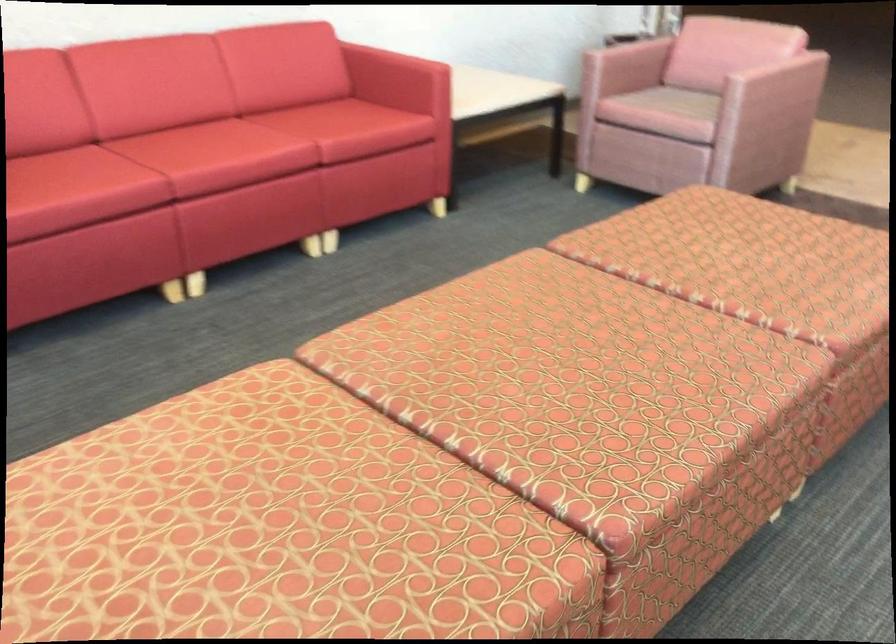
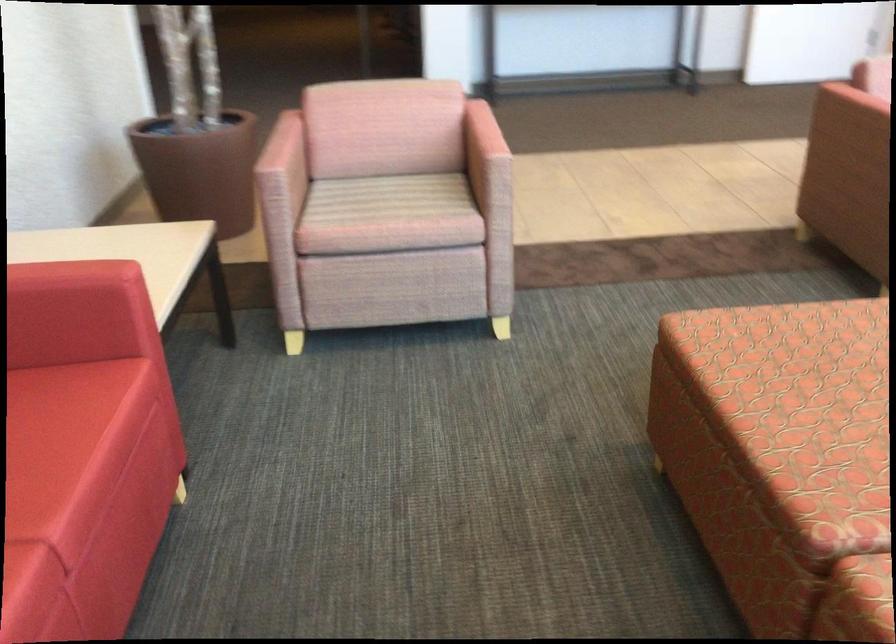
Find the pixel in the second image that matches (371,109) in the first image.

(38, 408)